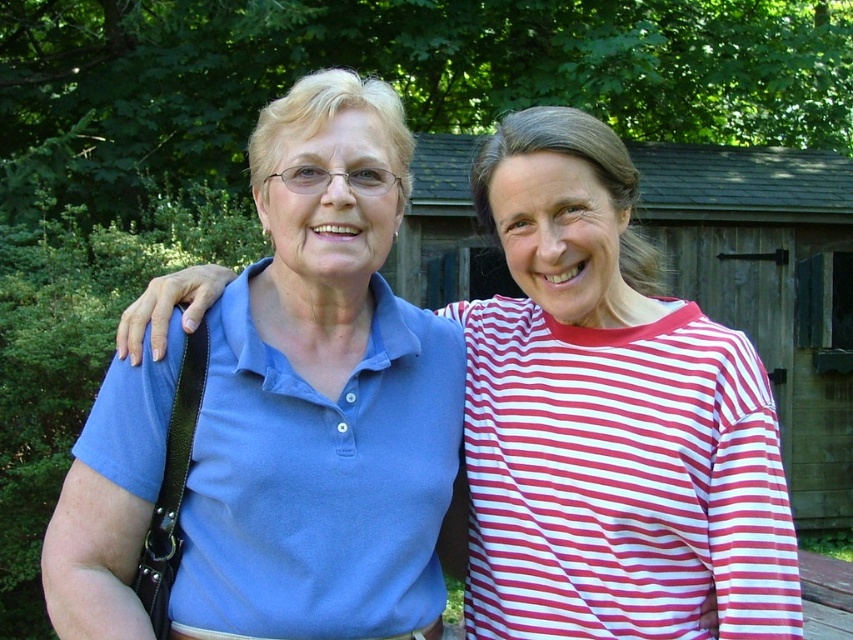
Can you confirm if red striped shirt at right is smaller than matte blue polo shirt at center?

No, red striped shirt at right is not smaller than matte blue polo shirt at center.

Does red striped shirt at right have a greater width compared to matte blue polo shirt at center?

No, red striped shirt at right is not wider than matte blue polo shirt at center.

Between point (538, 508) and point (422, 394), which one is positioned behind?

Point (422, 394)

I want to click on red striped shirt at right, so click(x=621, y=480).

Who is higher up, blue cotton polo shirt at center or matte blue polo shirt at center?

Positioned higher is blue cotton polo shirt at center.

The image size is (853, 640). In order to click on blue cotton polo shirt at center in this screenshot , I will do `click(608, 419)`.

Is blue cotton polo shirt at center positioned in front of red striped shirt at right?

Yes, it is.

Is blue cotton polo shirt at center wider than red striped shirt at right?

No.

Where is `blue cotton polo shirt at center`? The height and width of the screenshot is (640, 853). blue cotton polo shirt at center is located at coordinates (608, 419).